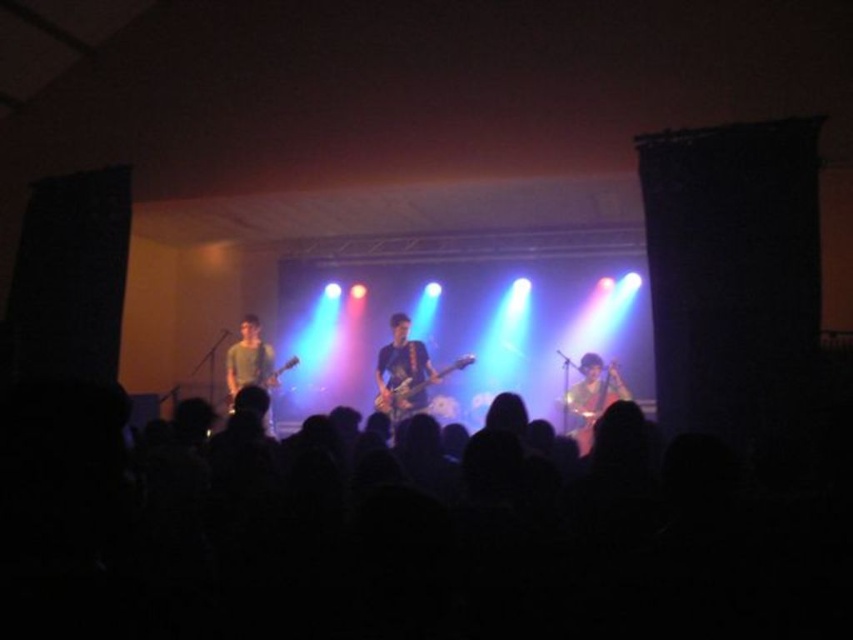
You are a stagehand who needs to adjust the microphone stand between the shiny brown guitar at center and the green matte shirt at center. The stand requires at least 10 feet of space to be placed safely. Based on the description, can you position the microphone stand between them?

The shiny brown guitar at center and green matte shirt at center are 9.68 feet apart, which is less than the required 10 feet. Therefore, the microphone stand cannot be safely positioned between them.

You are a photographer at the back of the venue trying to capture a clear photo of both the shiny brown guitar at center and the green matte shirt at center. Since you can only focus on one subject at a time, which one should you choose to ensure the other is still in the frame?

The shiny brown guitar at center is located below green matte shirt at center, so if you focus on the green matte shirt at center, the shiny brown guitar at center will still be visible in the lower part of the frame.